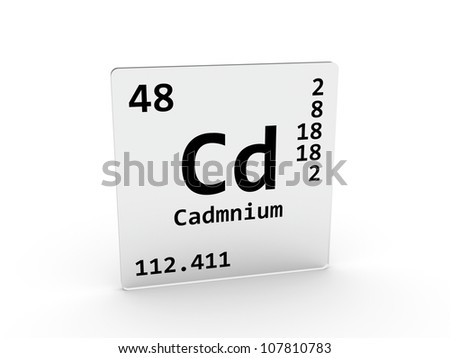
At what (x,y) coordinates should I click in order to perform the action: click on right corner. Please return your answer as a coordinate pair (x, y). This screenshot has width=450, height=358. Looking at the image, I should click on (336, 68).